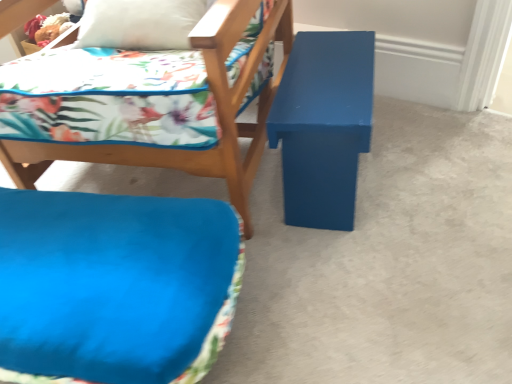
Question: Is matte blue bench at right looking in the opposite direction of blue matte bench at center?

Choices:
 (A) no
 (B) yes

Answer: (A)

Question: Does matte blue bench at right have a smaller size compared to blue matte bench at center?

Choices:
 (A) yes
 (B) no

Answer: (A)

Question: From a real-world perspective, is matte blue bench at right under blue matte bench at center?

Choices:
 (A) yes
 (B) no

Answer: (B)

Question: Is matte blue bench at right at the right side of blue matte bench at center?

Choices:
 (A) no
 (B) yes

Answer: (B)

Question: Can you confirm if matte blue bench at right is thinner than blue matte bench at center?

Choices:
 (A) yes
 (B) no

Answer: (A)

Question: Is matte blue bench at right positioned far away from blue matte bench at center?

Choices:
 (A) no
 (B) yes

Answer: (A)

Question: Can you confirm if matte blue cushion at center is shorter than blue matte bench at center?

Choices:
 (A) yes
 (B) no

Answer: (B)

Question: Considering the relative sizes of matte blue cushion at center and blue matte bench at center in the image provided, is matte blue cushion at center wider than blue matte bench at center?

Choices:
 (A) no
 (B) yes

Answer: (A)

Question: From a real-world perspective, is matte blue cushion at center physically above blue matte bench at center?

Choices:
 (A) yes
 (B) no

Answer: (A)

Question: Is matte blue cushion at center aimed at blue matte bench at center?

Choices:
 (A) no
 (B) yes

Answer: (A)

Question: Is matte blue cushion at center far from blue matte bench at center?

Choices:
 (A) no
 (B) yes

Answer: (A)

Question: Can you confirm if matte blue cushion at center is bigger than blue matte bench at center?

Choices:
 (A) yes
 (B) no

Answer: (A)

Question: Is matte blue bench at right oriented away from blue fabric cushion at lower left?

Choices:
 (A) no
 (B) yes

Answer: (A)